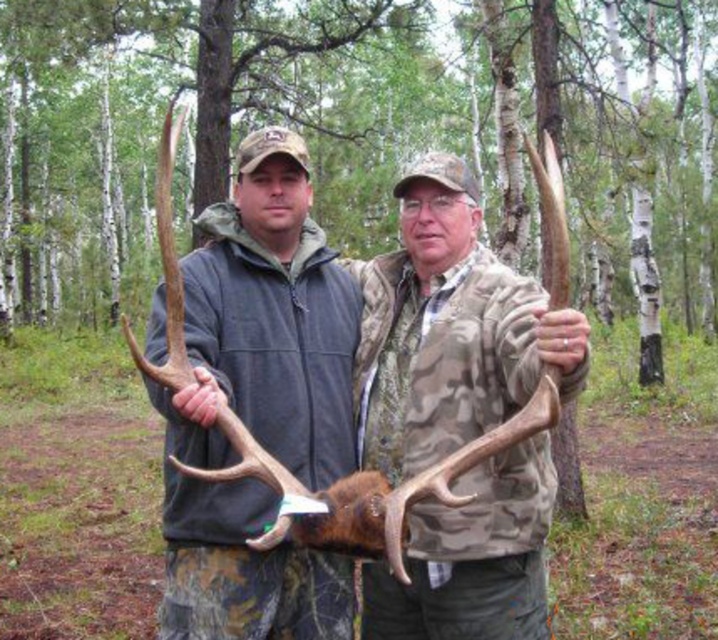
You are standing in the forest where the two people are posing with the deer antlers. You want to place a marker at point A and point B, which are labeled as point (467, 202) and point (215, 598) respectively. If you are facing the same direction as the people in the photo, which point is closer to you?

Point (215, 598) is closer to you because it is in front of point (467, 202).

You are a photographer standing 1.5 meters away from the matte brown antlers at center. You want to take a closeup shot of the antlers. Do you need to move closer or farther away?

The matte brown antlers at center are currently 1.47 meters away from the camera. Since you are standing 1.5 meters away, you need to move slightly closer to achieve the desired closeup shot.

You are a wildlife researcher observing the scene. You need to determine the spatial relationship between the matte brown antlers at center and the camouflage jacket at center. Based on the scene, which object is positioned higher?

The matte brown antlers at center are located above the camouflage jacket at center, so the matte brown antlers at center are higher.